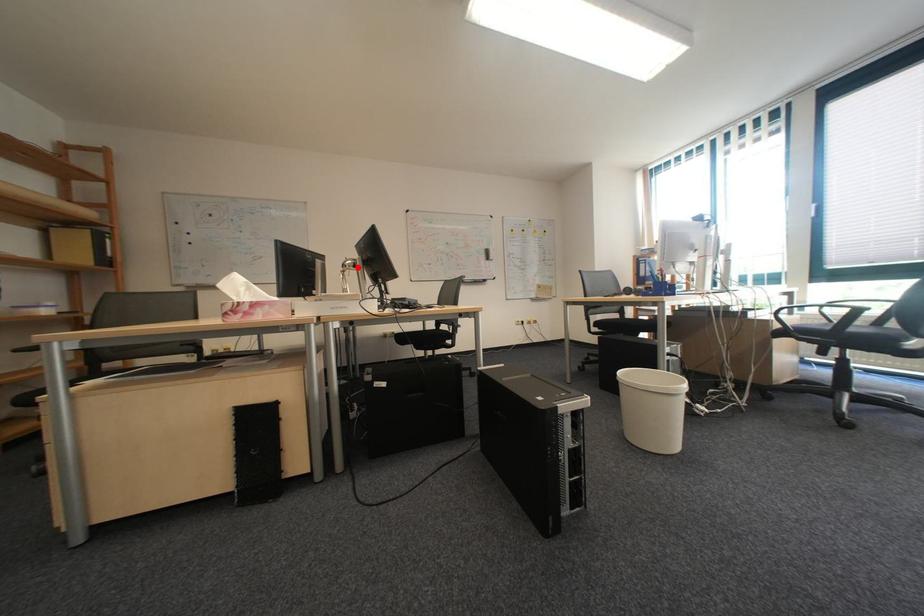
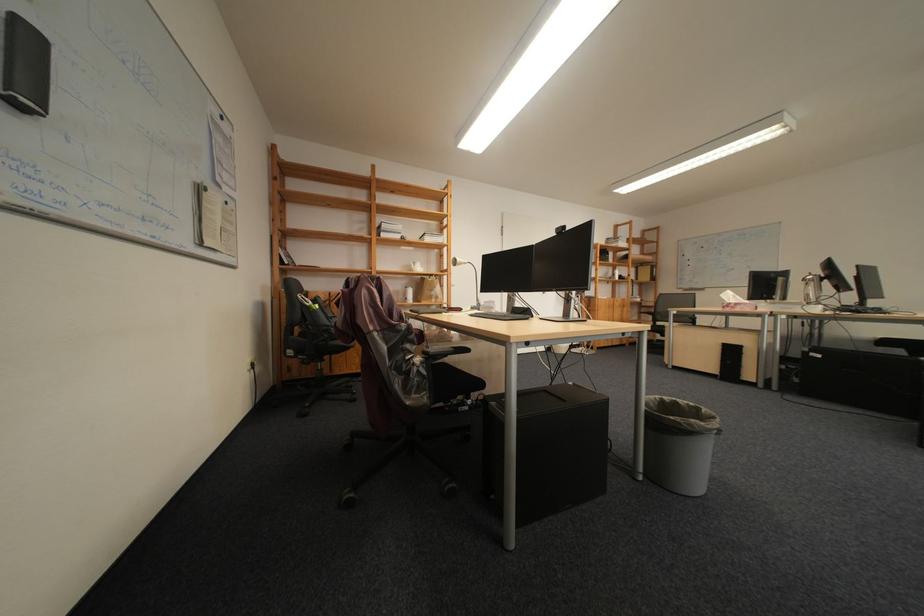
In the second image, find the point that corresponds to the highlighted location in the first image.

(819, 282)